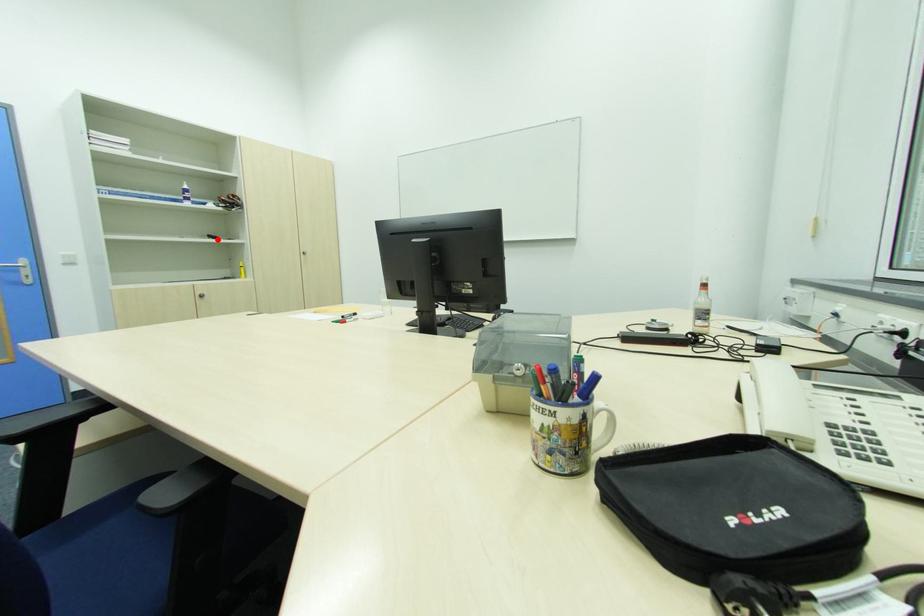
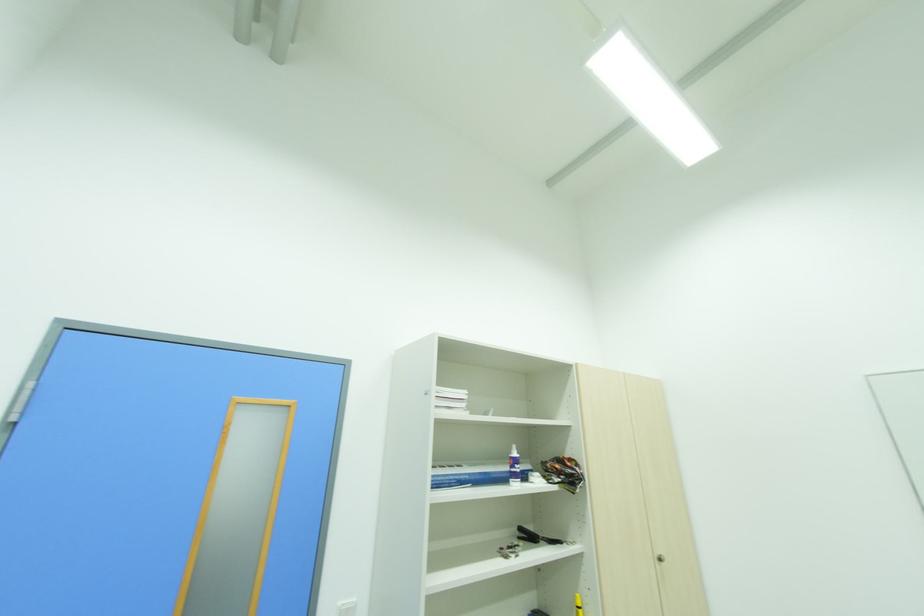
In the second image, find the point that corresponds to the highlighted location in the first image.

(536, 539)